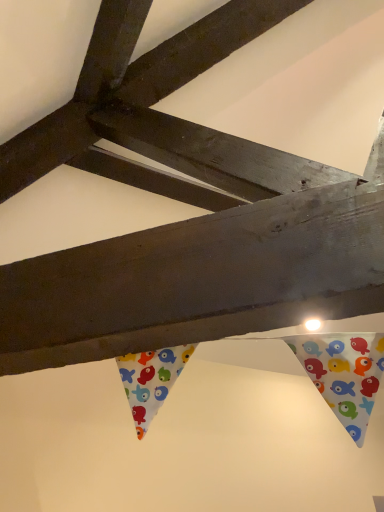
Measure the distance between point [221,159] and camera.

Point [221,159] and camera are 36.14 inches apart from each other.

The width and height of the screenshot is (384, 512). What do you see at coordinates (186, 220) in the screenshot?
I see `wooden beam at center` at bounding box center [186, 220].

Identify the location of wooden beam at center. The height and width of the screenshot is (512, 384). (186, 220).

This screenshot has height=512, width=384. In order to click on wooden beam at center in this screenshot , I will do `click(186, 220)`.